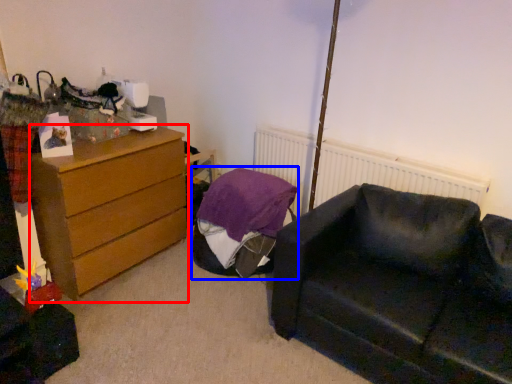
Question: Which object appears closest to the camera in this image, chest of drawers (highlighted by a red box) or bean bag chair (highlighted by a blue box)?

Choices:
 (A) chest of drawers
 (B) bean bag chair

Answer: (A)